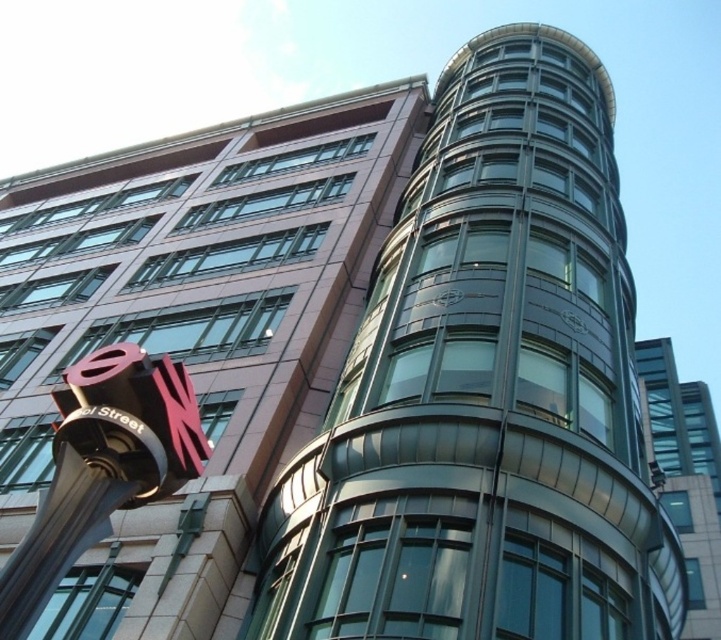
Question: Is brushed metal sign at lower left below metallic glass building at right?

Choices:
 (A) yes
 (B) no

Answer: (B)

Question: Can you confirm if brushed metal sign at lower left is positioned to the right of metallic glass building at right?

Choices:
 (A) yes
 (B) no

Answer: (B)

Question: Which point is closer to the camera?

Choices:
 (A) (105, 456)
 (B) (709, 566)

Answer: (A)

Question: Which of the following is the farthest from the observer?

Choices:
 (A) (715, 420)
 (B) (35, 532)

Answer: (A)

Question: Can you confirm if brushed metal sign at lower left is thinner than metallic glass building at right?

Choices:
 (A) no
 (B) yes

Answer: (B)